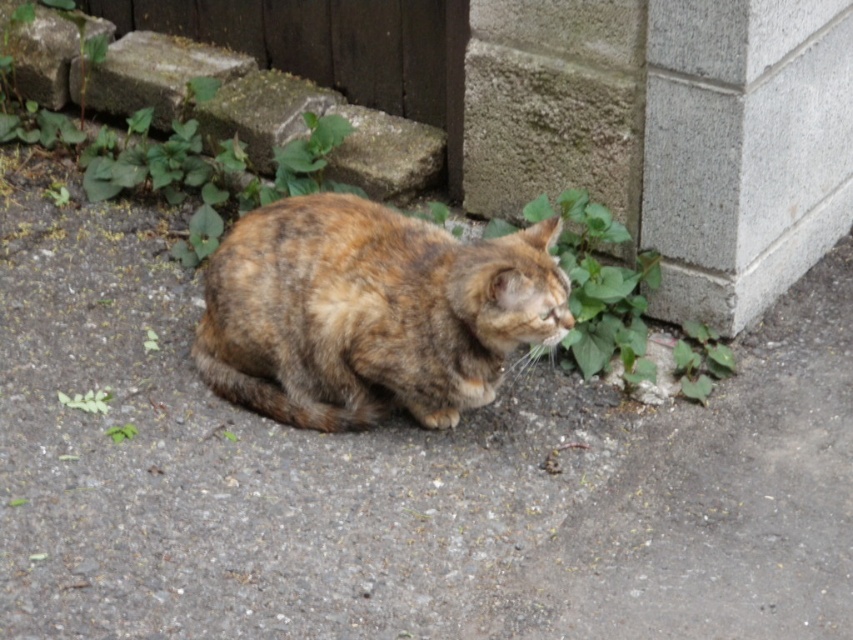
Is point (711, 300) less distant than point (370, 390)?

No, it is behind (370, 390).

Is the position of gray rough concrete at lower right less distant than that of tabby fur cat at center?

No, it is not.

Between point (665, 124) and point (405, 339), which one is positioned behind?

Point (665, 124)

Locate an element on the screen. The height and width of the screenshot is (640, 853). gray rough concrete at lower right is located at coordinates (672, 131).